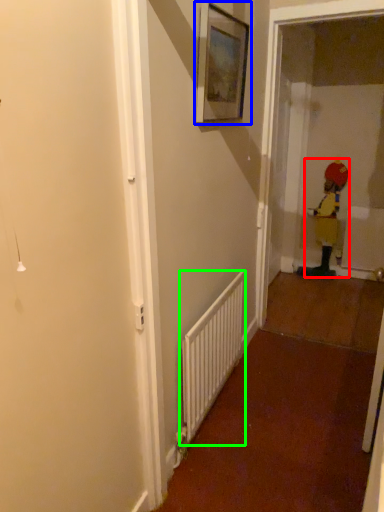
Question: Based on their relative distances, which object is farther from toddler (highlighted by a red box)? Choose from picture frame (highlighted by a blue box) and radiator (highlighted by a green box).

Choices:
 (A) picture frame
 (B) radiator

Answer: (A)